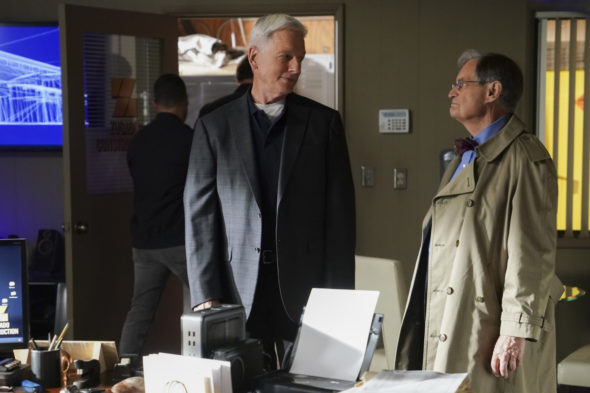
The height and width of the screenshot is (393, 590). Find the location of `window`. window is located at coordinates (121, 55), (572, 79).